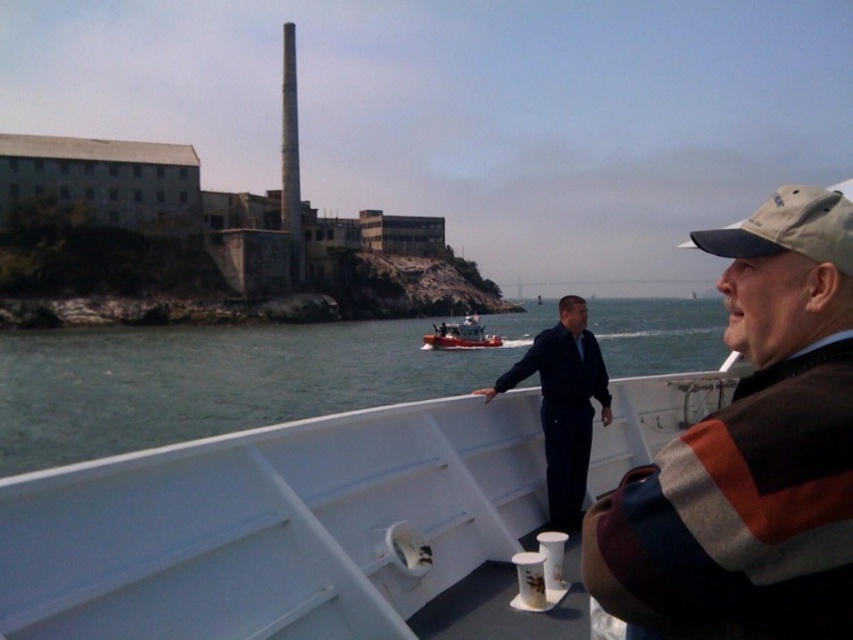
Looking at this image, you are a passenger on the boat tour and want to take a photo of the brown striped sweater at right and the metallic red boat at center. Which object should you focus on first if you want to capture both in the same frame?

The brown striped sweater at right is located below the metallic red boat at center, so you should focus on the metallic red boat at center first to ensure both are in the frame.